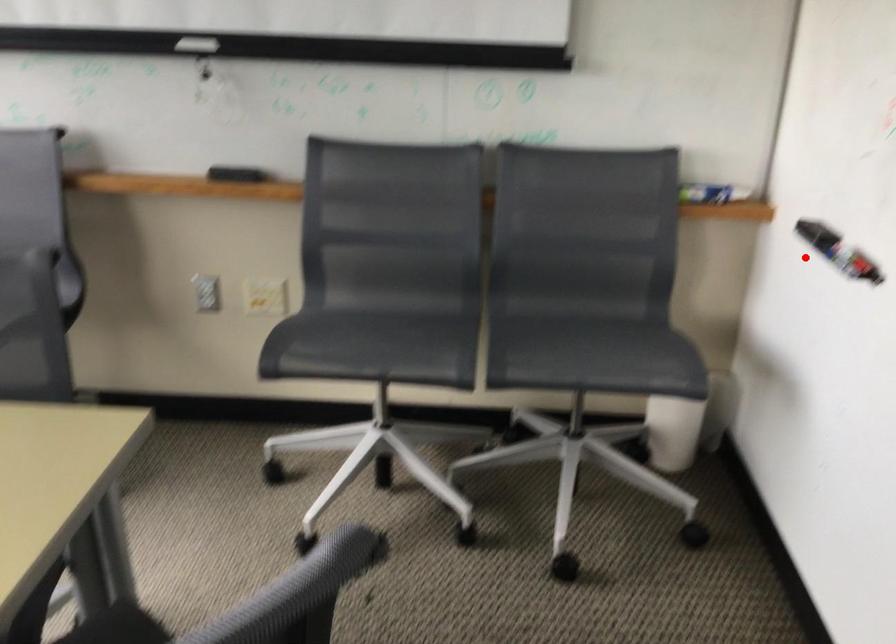
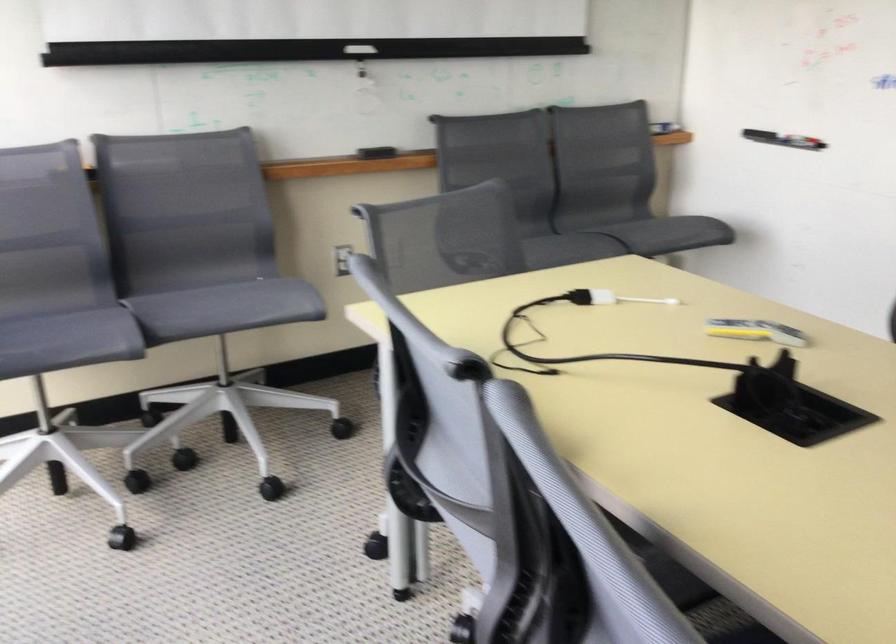
Where in the second image is the point corresponding to the highlighted location from the first image?

(782, 138)